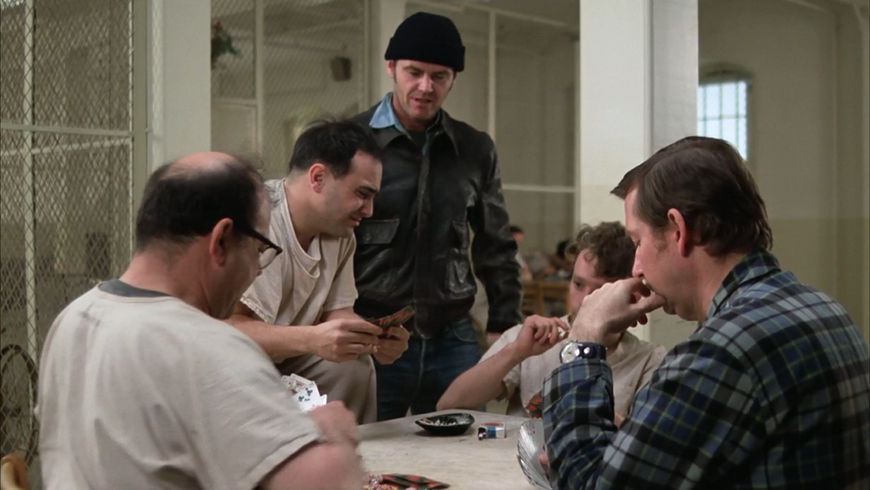
What are the coordinates of `window` in the screenshot? It's located at (731, 97).